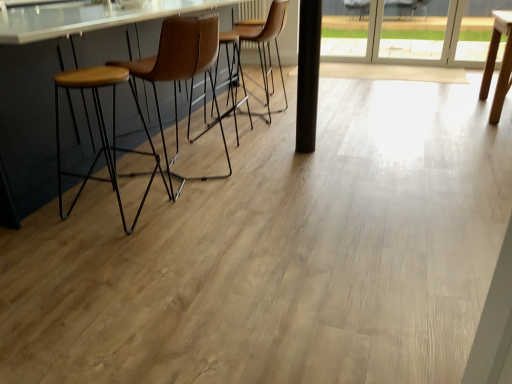
The height and width of the screenshot is (384, 512). In order to click on free area in between brown leather stool at left, the second chair viewed from the back, and black matte pole at center in this screenshot , I will do `click(249, 158)`.